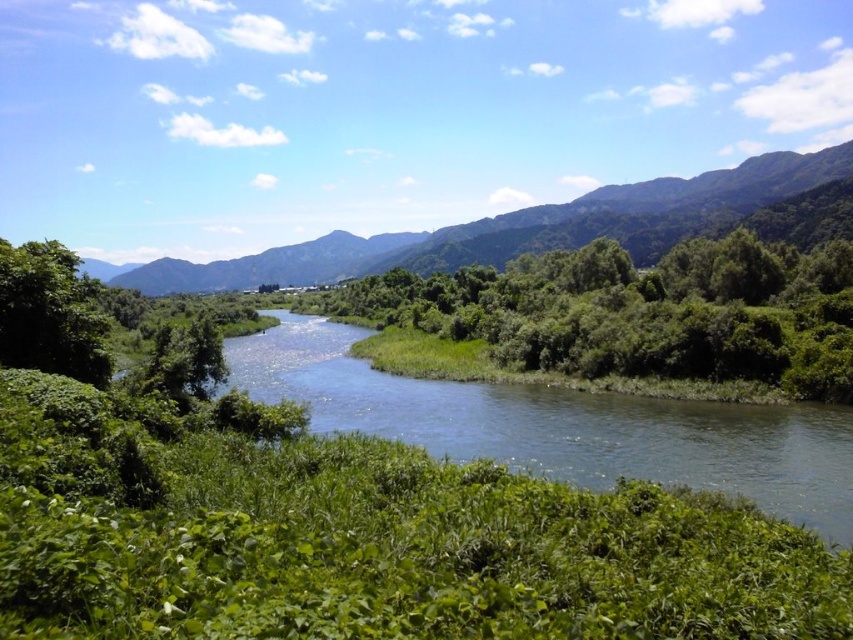
Question: Can you confirm if green leafy shrub at center is bigger than blue smooth water at center?

Choices:
 (A) yes
 (B) no

Answer: (A)

Question: Which of the following is the closest to the observer?

Choices:
 (A) (65, 262)
 (B) (622, 380)

Answer: (A)

Question: Where is green leafy mountain at upper center located in relation to green leafy tree at left in the image?

Choices:
 (A) left
 (B) right

Answer: (A)

Question: Is blue smooth water at center above green leafy tree at left?

Choices:
 (A) yes
 (B) no

Answer: (B)

Question: Which of the following is the closest to the observer?

Choices:
 (A) blue smooth water at center
 (B) green leafy tree at left
 (C) green leafy shrub at center

Answer: (A)

Question: Based on their relative distances, which object is farther from the blue smooth water at center?

Choices:
 (A) green leafy shrub at center
 (B) green leafy mountain at upper center

Answer: (B)